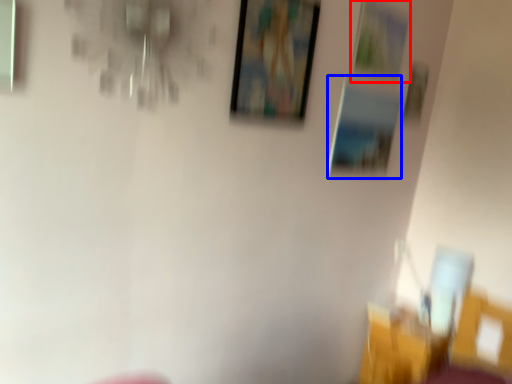
Question: Which point is closer to the camera, picture frame (highlighted by a red box) or picture frame (highlighted by a blue box)?

Choices:
 (A) picture frame
 (B) picture frame

Answer: (A)